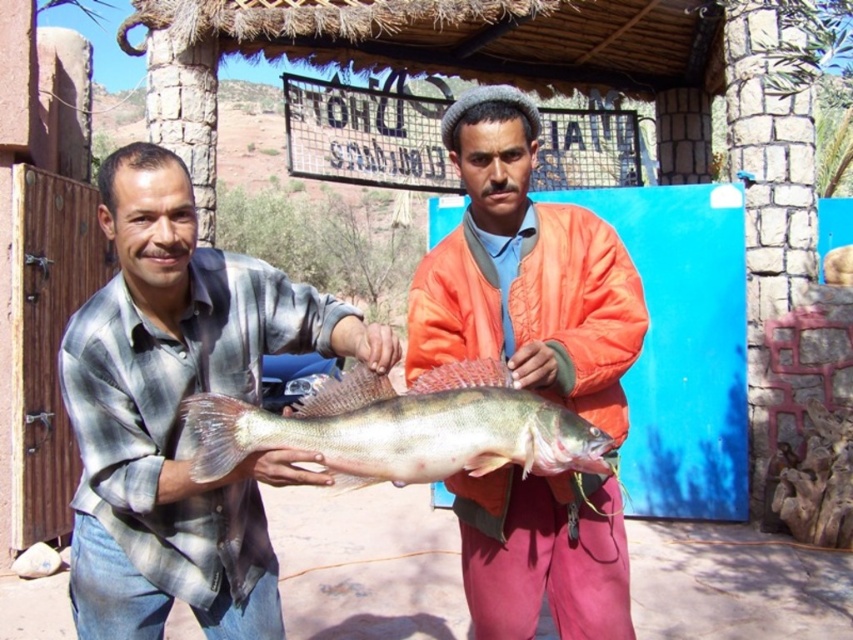
Question: Which of the following is the closest to the observer?

Choices:
 (A) shiny silver fish at center
 (B) plaid shirt at center

Answer: (B)

Question: Observing the image, what is the correct spatial positioning of plaid shirt at center in reference to shiny silver fish at center?

Choices:
 (A) right
 (B) left

Answer: (B)

Question: Which point is farther from the camera taking this photo?

Choices:
 (A) (599, 467)
 (B) (169, 493)
 (C) (567, 476)

Answer: (C)

Question: Is orange quilted jacket at center above shiny silver fish at center?

Choices:
 (A) no
 (B) yes

Answer: (B)

Question: Estimate the real-world distances between objects in this image. Which object is closer to the shiny silver fish at center?

Choices:
 (A) orange quilted jacket at center
 (B) plaid shirt at center

Answer: (A)

Question: Is plaid shirt at center above orange quilted jacket at center?

Choices:
 (A) no
 (B) yes

Answer: (A)